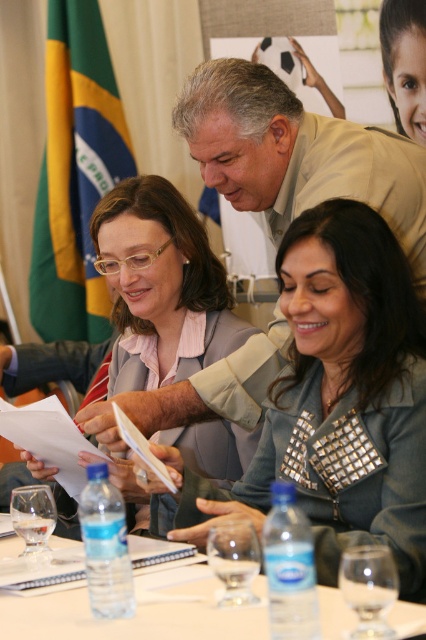
Question: Where is satin gray blazer at center located in relation to green fabric flag at upper left in the image?

Choices:
 (A) above
 (B) below

Answer: (B)

Question: Which of the following is the closest to the observer?

Choices:
 (A) (379, 432)
 (B) (6, 538)
 (C) (204, 150)
 (D) (89, 268)

Answer: (A)

Question: Which object is closer to the camera taking this photo?

Choices:
 (A) green fabric flag at upper left
 (B) matte gray blazer at center
 (C) clear plastic water bottles at lower center
 (D) beige textured suit at upper center

Answer: (C)

Question: Is beige textured suit at upper center wider than green fabric flag at upper left?

Choices:
 (A) no
 (B) yes

Answer: (B)

Question: Can you confirm if satin gray blazer at center is thinner than green fabric flag at upper left?

Choices:
 (A) yes
 (B) no

Answer: (B)

Question: Estimate the real-world distances between objects in this image. Which object is closer to the matte gray blazer at center?

Choices:
 (A) green fabric flag at upper left
 (B) satin gray blazer at center
 (C) clear plastic water bottles at lower center
 (D) beige textured suit at upper center

Answer: (D)